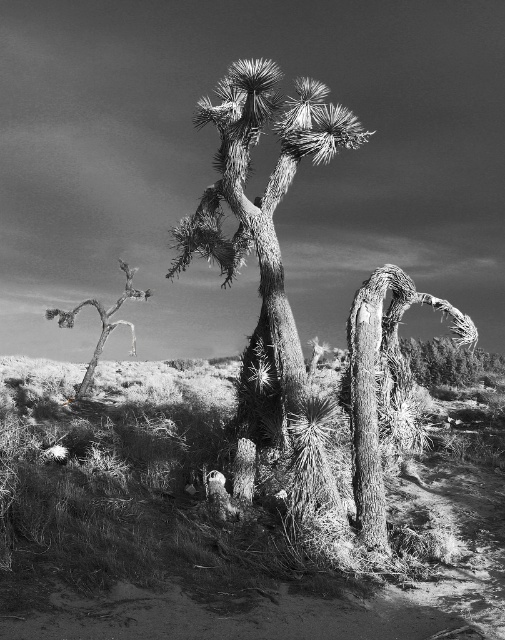
Does point (229, 196) come in front of point (92, 304)?

Yes, it is.

Is rough bark joshua tree at center shorter than scraggly white tree at left?

No, rough bark joshua tree at center is not shorter than scraggly white tree at left.

Is point (277, 74) more distant than point (94, 364)?

No, (277, 74) is closer to viewer.

Identify the location of rough bark joshua tree at center. (262, 221).

Does rough textured tree at center have a smaller size compared to scraggly white tree at left?

Correct, rough textured tree at center occupies less space than scraggly white tree at left.

From the picture: Is rough textured tree at center behind scraggly white tree at left?

No, rough textured tree at center is closer to the viewer.

Measure the distance between point (356, 440) and camera.

7.95 meters

You are a GUI agent. You are given a task and a screenshot of the screen. Output one action in this format:
    pyautogui.click(x=<x>, y=<y>)
    Task: Click on the rough textured tree at center
    The height and width of the screenshot is (640, 505).
    Given the screenshot: What is the action you would take?
    pyautogui.click(x=383, y=387)

In the scene shown: Measure the distance between rough bark joshua tree at center and camera.

8.12 meters

Can you confirm if rough bark joshua tree at center is positioned to the right of rough textured tree at center?

No, rough bark joshua tree at center is not to the right of rough textured tree at center.

Image resolution: width=505 pixels, height=640 pixels. I want to click on rough bark joshua tree at center, so click(x=262, y=221).